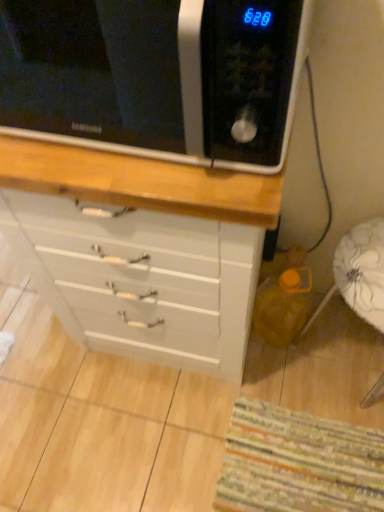
Question: Considering the relative sizes of white glossy chest of drawers at center and black matte microwave at upper left in the image provided, is white glossy chest of drawers at center shorter than black matte microwave at upper left?

Choices:
 (A) no
 (B) yes

Answer: (A)

Question: From a real-world perspective, is white glossy chest of drawers at center located higher than black matte microwave at upper left?

Choices:
 (A) no
 (B) yes

Answer: (A)

Question: From the image's perspective, is white glossy chest of drawers at center over black matte microwave at upper left?

Choices:
 (A) no
 (B) yes

Answer: (A)

Question: Does white glossy chest of drawers at center lie behind black matte microwave at upper left?

Choices:
 (A) yes
 (B) no

Answer: (A)

Question: From the image's perspective, is white glossy chest of drawers at center located beneath black matte microwave at upper left?

Choices:
 (A) no
 (B) yes

Answer: (B)

Question: Is white fabric swivel chair at lower right to the left or to the right of striped fabric mat at lower right in the image?

Choices:
 (A) right
 (B) left

Answer: (A)

Question: Considering the positions of point (334, 266) and point (309, 441), is point (334, 266) closer or farther from the camera than point (309, 441)?

Choices:
 (A) closer
 (B) farther

Answer: (A)

Question: Considering the positions of white fabric swivel chair at lower right and striped fabric mat at lower right in the image, is white fabric swivel chair at lower right taller or shorter than striped fabric mat at lower right?

Choices:
 (A) short
 (B) tall

Answer: (B)

Question: Looking at their shapes, would you say white fabric swivel chair at lower right is wider or thinner than striped fabric mat at lower right?

Choices:
 (A) wide
 (B) thin

Answer: (B)

Question: Is point pos(82,286) positioned closer to the camera than point pos(327,457)?

Choices:
 (A) farther
 (B) closer

Answer: (B)

Question: From their relative heights in the image, would you say white glossy chest of drawers at center is taller or shorter than striped fabric mat at lower right?

Choices:
 (A) short
 (B) tall

Answer: (B)

Question: From a real-world perspective, relative to striped fabric mat at lower right, is white glossy chest of drawers at center vertically above or below?

Choices:
 (A) below
 (B) above

Answer: (B)

Question: Do you think white glossy chest of drawers at center is within striped fabric mat at lower right, or outside of it?

Choices:
 (A) outside
 (B) inside

Answer: (A)

Question: Relative to white glossy chest of drawers at center, is striped fabric mat at lower right in front or behind?

Choices:
 (A) behind
 (B) front

Answer: (A)

Question: Considering the relative positions of striped fabric mat at lower right and white glossy chest of drawers at center in the image provided, is striped fabric mat at lower right to the left or to the right of white glossy chest of drawers at center?

Choices:
 (A) right
 (B) left

Answer: (A)